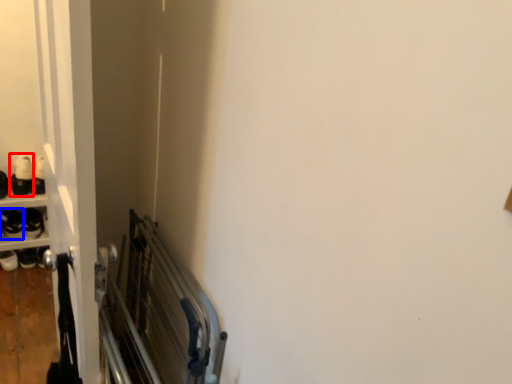
Question: Which object appears closest to the camera in this image, footwear (highlighted by a red box) or footwear (highlighted by a blue box)?

Choices:
 (A) footwear
 (B) footwear

Answer: (B)